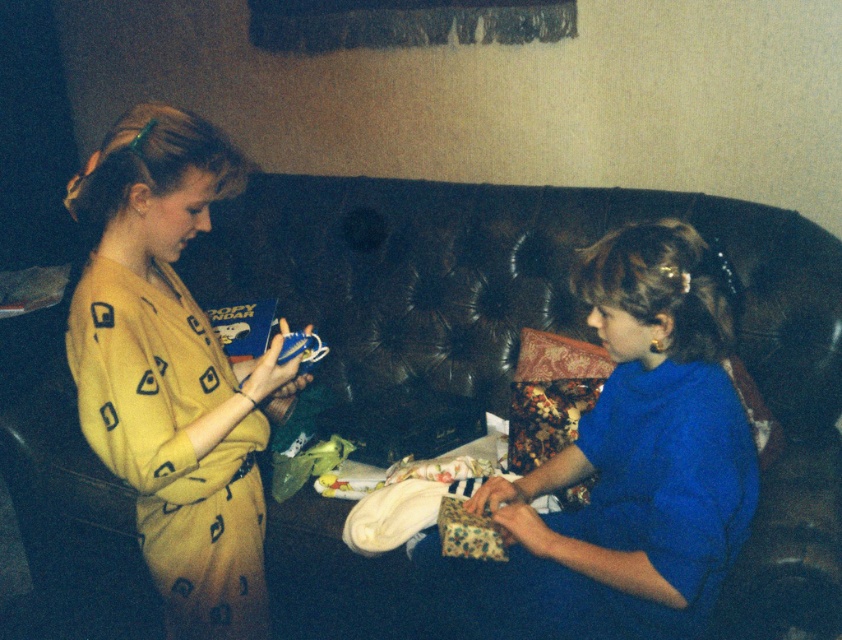
Question: Estimate the real-world distances between objects in this image. Which object is closer to the leather couch at center?

Choices:
 (A) blue satin dress at center
 (B) yellow printed dress at left

Answer: (A)

Question: Does leather couch at center lie behind yellow printed dress at left?

Choices:
 (A) no
 (B) yes

Answer: (B)

Question: Which of the following is the farthest from the observer?

Choices:
 (A) [x=547, y=611]
 (B) [x=744, y=227]
 (C) [x=180, y=625]

Answer: (B)

Question: Which object is positioned farthest from the blue satin dress at center?

Choices:
 (A) leather couch at center
 (B) yellow printed dress at left

Answer: (B)

Question: In this image, where is yellow printed dress at left located relative to blue satin dress at center?

Choices:
 (A) right
 (B) left

Answer: (B)

Question: From the image, what is the correct spatial relationship of leather couch at center in relation to blue satin dress at center?

Choices:
 (A) left
 (B) right

Answer: (A)